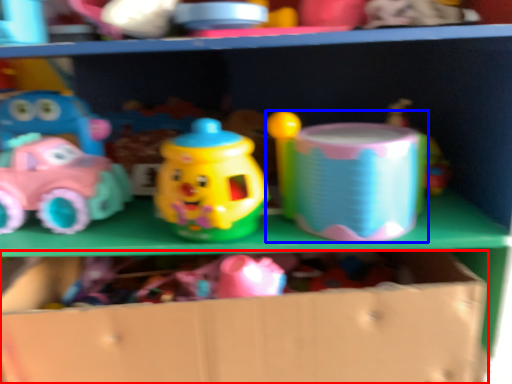
Question: Among these objects, which one is farthest to the camera, cardboard box (highlighted by a red box) or toy (highlighted by a blue box)?

Choices:
 (A) cardboard box
 (B) toy

Answer: (B)